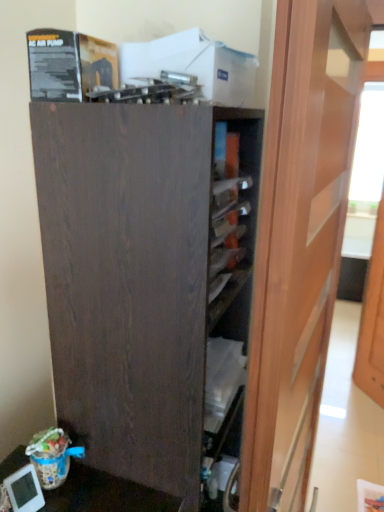
Locate an element on the screen. Image resolution: width=384 pixels, height=512 pixels. vacant space underneath wooden door at right, which is counted as the 1th door, starting from the right (from a real-world perspective) is located at coordinates (370, 399).